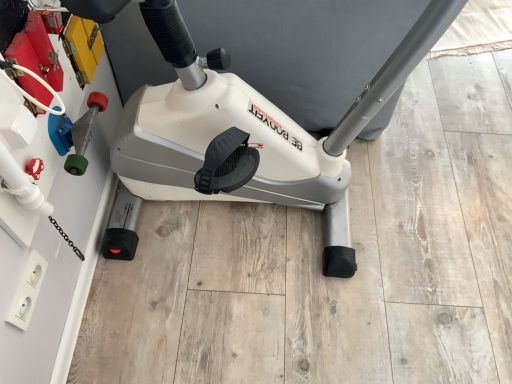
The height and width of the screenshot is (384, 512). What do you see at coordinates (245, 136) in the screenshot?
I see `white matte stationary bicycle at center` at bounding box center [245, 136].

At what (x,y) coordinates should I click in order to perform the action: click on white matte stationary bicycle at center. Please return your answer as a coordinate pair (x, y). The image size is (512, 384). Looking at the image, I should click on (245, 136).

The width and height of the screenshot is (512, 384). Find the location of `white matte stationary bicycle at center`. white matte stationary bicycle at center is located at coordinates (245, 136).